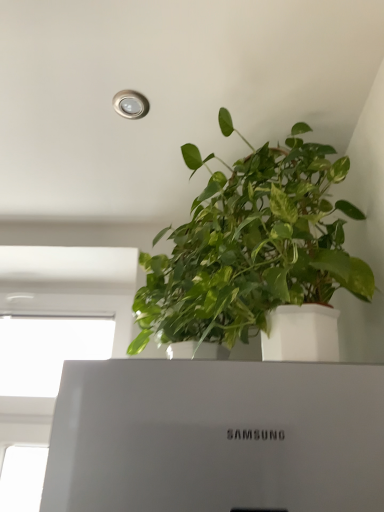
What do you see at coordinates (47, 352) in the screenshot? I see `white glossy window at lower left` at bounding box center [47, 352].

Where is `white glossy window at lower left`? Image resolution: width=384 pixels, height=512 pixels. white glossy window at lower left is located at coordinates 47,352.

The image size is (384, 512). What do you see at coordinates (252, 249) in the screenshot? I see `green matte plant at upper center` at bounding box center [252, 249].

Identify the location of green matte plant at upper center. (252, 249).

Where is `white glossy window at lower left`? This screenshot has height=512, width=384. white glossy window at lower left is located at coordinates (47, 352).

Based on their positions, is white glossy window at lower left located to the left or right of green matte plant at upper center?

Clearly, white glossy window at lower left is on the left of green matte plant at upper center in the image.

In the scene shown: Considering the positions of objects white glossy window at lower left and green matte plant at upper center in the image provided, who is in front, white glossy window at lower left or green matte plant at upper center?

Positioned in front is white glossy window at lower left.

Does point (14, 336) come farther from viewer compared to point (170, 282)?

Yes, point (14, 336) is farther from viewer.

From the image's perspective, is white glossy window at lower left located beneath green matte plant at upper center?

Yes.

From a real-world perspective, is white glossy window at lower left physically below green matte plant at upper center?

Yes.

Is white glossy window at lower left wider than green matte plant at upper center?

No.

Considering the relative sizes of white glossy window at lower left and green matte plant at upper center in the image provided, is white glossy window at lower left taller than green matte plant at upper center?

No.

Considering the relative sizes of white glossy window at lower left and green matte plant at upper center in the image provided, is white glossy window at lower left bigger than green matte plant at upper center?

Incorrect, white glossy window at lower left is not larger than green matte plant at upper center.

Is green matte plant at upper center inside white glossy window at lower left?

No, green matte plant at upper center is not inside white glossy window at lower left.

Are white glossy window at lower left and green matte plant at upper center located far from each other?

Actually, white glossy window at lower left and green matte plant at upper center are a little close together.

Does white glossy window at lower left turn towards green matte plant at upper center?

No, white glossy window at lower left does not turn towards green matte plant at upper center.

The image size is (384, 512). In order to click on houseplant lying behind the white glossy window at lower left in this screenshot , I will do `click(252, 249)`.

Considering the relative positions of green matte plant at upper center and white glossy window at lower left in the image provided, is green matte plant at upper center to the right of white glossy window at lower left from the viewer's perspective?

Yes, green matte plant at upper center is to the right of white glossy window at lower left.

Does green matte plant at upper center come in front of white glossy window at lower left?

No, it is behind white glossy window at lower left.

Is point (180, 314) positioned after point (3, 390)?

No.

From the image's perspective, is green matte plant at upper center below white glossy window at lower left?

Incorrect, from the image's perspective, green matte plant at upper center is higher than white glossy window at lower left.

From a real-world perspective, who is located lower, green matte plant at upper center or white glossy window at lower left?

white glossy window at lower left is physically lower.

Between green matte plant at upper center and white glossy window at lower left, which one has larger width?

green matte plant at upper center is wider.

Does green matte plant at upper center have a greater height compared to white glossy window at lower left?

Correct, green matte plant at upper center is much taller as white glossy window at lower left.

Based on their sizes in the image, would you say green matte plant at upper center is bigger or smaller than white glossy window at lower left?

Clearly, green matte plant at upper center is larger in size than white glossy window at lower left.

Would you say green matte plant at upper center contains white glossy window at lower left?

No, green matte plant at upper center does not contain white glossy window at lower left.

Is green matte plant at upper center far from white glossy window at lower left?

green matte plant at upper center is actually quite close to white glossy window at lower left.

Does green matte plant at upper center turn towards white glossy window at lower left?

No, green matte plant at upper center does not turn towards white glossy window at lower left.

Measure the distance between green matte plant at upper center and white glossy window at lower left.

A distance of 33.55 inches exists between green matte plant at upper center and white glossy window at lower left.

The height and width of the screenshot is (512, 384). I want to click on houseplant that is above the white glossy window at lower left (from the image's perspective), so click(x=252, y=249).

Locate an element on the screen. window below the green matte plant at upper center (from the image's perspective) is located at coordinates (47, 352).

The width and height of the screenshot is (384, 512). Find the location of `houseplant that appears on the right of white glossy window at lower left`. houseplant that appears on the right of white glossy window at lower left is located at coordinates (252, 249).